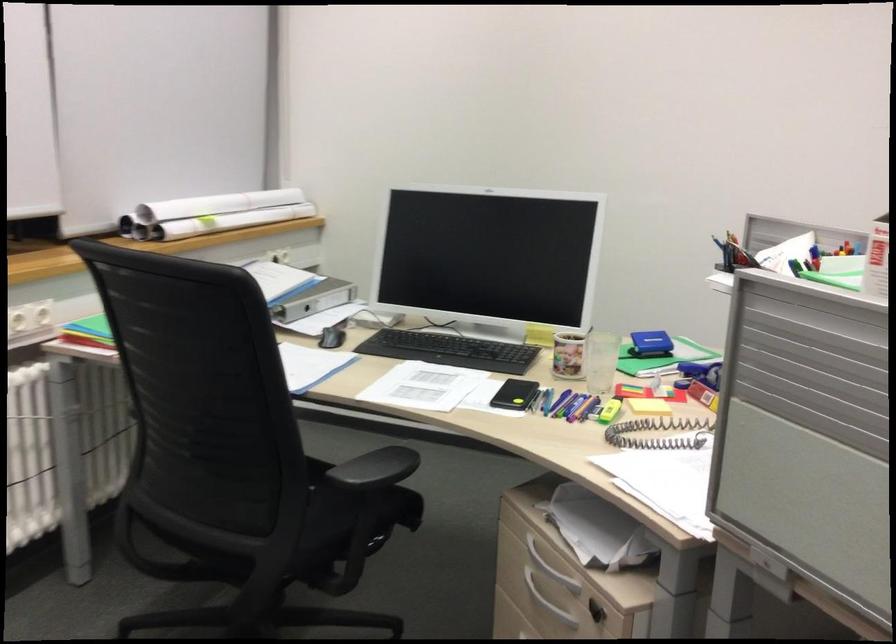
Where would you lift the patterned mug? Please return your answer as a coordinate pair (x, y).

(567, 355)